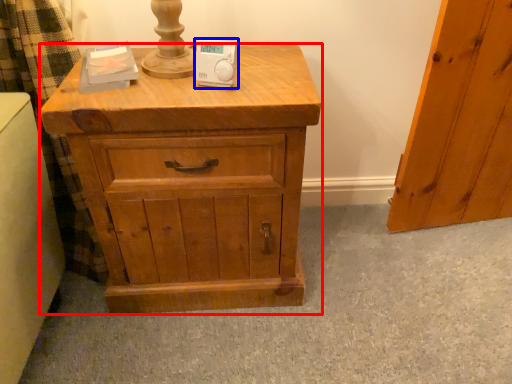
Question: Which object is closer to the camera taking this photo, chest of drawers (highlighted by a red box) or ipod (highlighted by a blue box)?

Choices:
 (A) chest of drawers
 (B) ipod

Answer: (A)